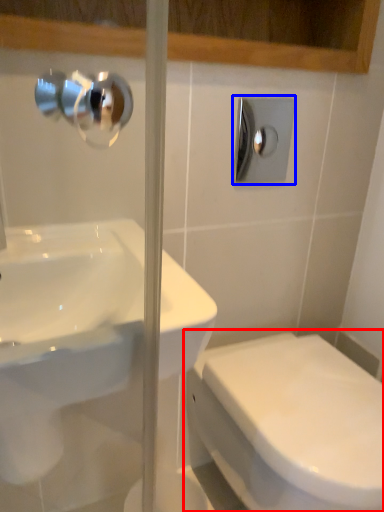
Question: Which point is further to the camera, toilet (highlighted by a red box) or shower (highlighted by a blue box)?

Choices:
 (A) toilet
 (B) shower

Answer: (B)